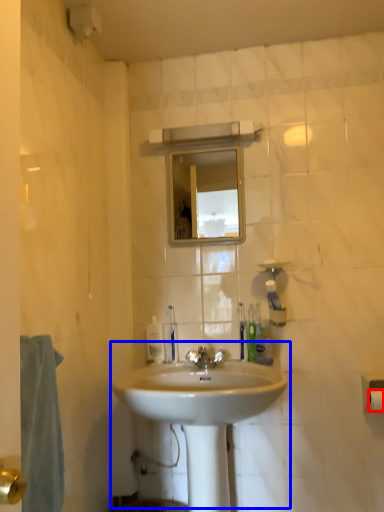
Question: Which of the following is the farthest to the observer, toilet paper (highlighted by a red box) or sink (highlighted by a blue box)?

Choices:
 (A) toilet paper
 (B) sink

Answer: (A)